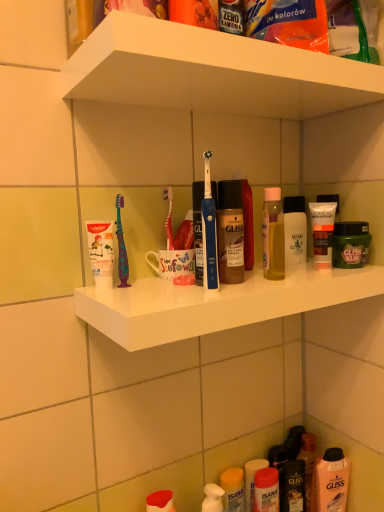
At what (x,y) coordinates should I click in order to perform the action: click on free location to the right of white matte toothpaste tube at left, placed as the first toiletry when sorted from left to right. Please return your answer as a coordinate pair (x, y). The image size is (384, 512). Looking at the image, I should click on (168, 291).